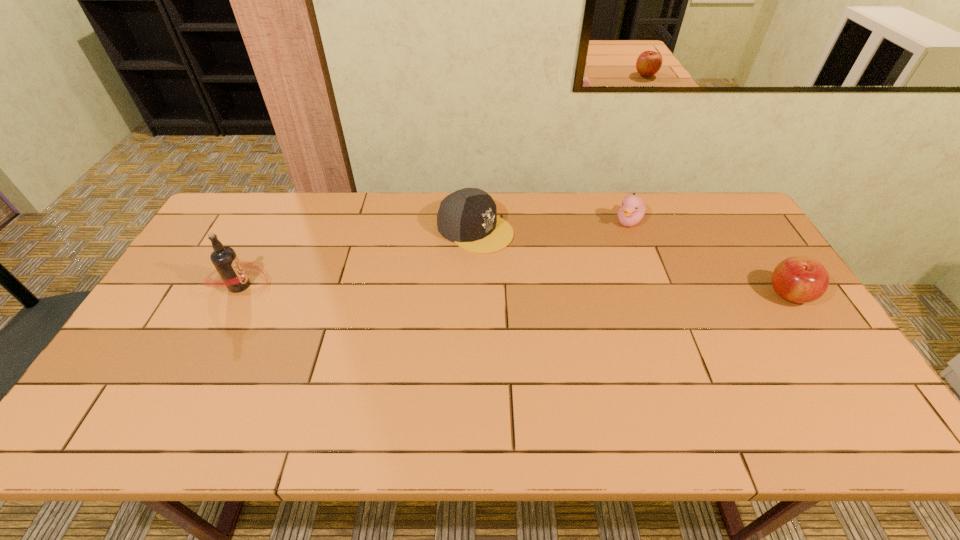
Identify the location of vacant space on the desktop that is between the tallest object and the apple and is positioned on the front-facing side of the second object from right to left. This screenshot has width=960, height=540. (588, 291).

Where is `free space on the desktop that is between the leftmost object and the apple and is positioned on the front-facing side of the cap`? Image resolution: width=960 pixels, height=540 pixels. free space on the desktop that is between the leftmost object and the apple and is positioned on the front-facing side of the cap is located at coordinates (593, 291).